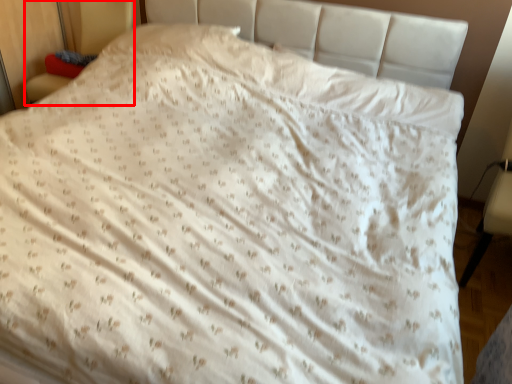
Question: Observing the image, what is the correct spatial positioning of armchair (annotated by the red box) in reference to armchair?

Choices:
 (A) right
 (B) left

Answer: (B)